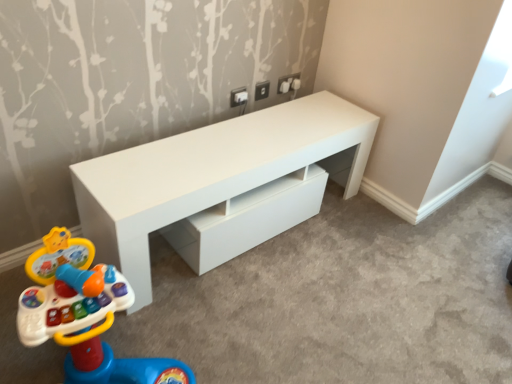
You are a GUI agent. You are given a task and a screenshot of the screen. Output one action in this format:
    pyautogui.click(x=<x>, y=<y>)
    Task: Click on the free spot to the right of plastic multicolored xylophone at lower left
    
    Given the screenshot: What is the action you would take?
    pyautogui.click(x=255, y=327)